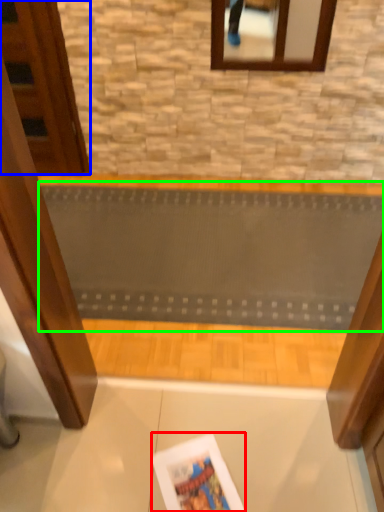
Question: Estimate the real-world distances between objects in this image. Which object is farther from magazine (highlighted by a red box), door (highlighted by a blue box) or ramp (highlighted by a green box)?

Choices:
 (A) door
 (B) ramp

Answer: (A)